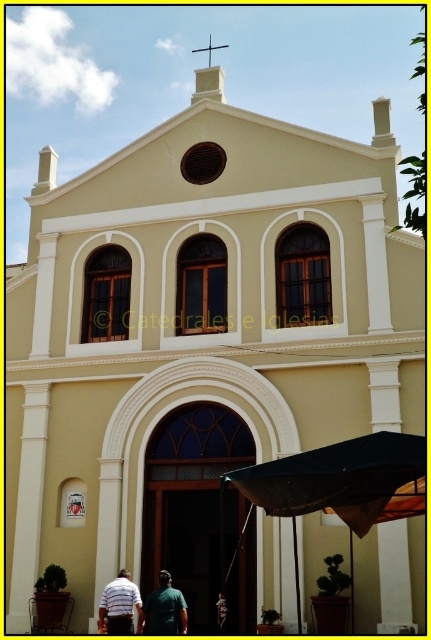
The image size is (431, 640). What do you see at coordinates (340, 483) in the screenshot?
I see `dark fabric umbrella at lower center` at bounding box center [340, 483].

Is dark fabric umbrella at lower center below green matte shirt at lower center?

Actually, dark fabric umbrella at lower center is above green matte shirt at lower center.

In order to click on dark fabric umbrella at lower center in this screenshot , I will do `click(340, 483)`.

You are a GUI agent. You are given a task and a screenshot of the screen. Output one action in this format:
    pyautogui.click(x=<x>, y=<y>)
    Task: Click on the dark fabric umbrella at lower center
    
    Given the screenshot: What is the action you would take?
    pyautogui.click(x=340, y=483)

Is dark fabric umbrella at lower center to the right of striped shirt at lower center from the viewer's perspective?

Yes, dark fabric umbrella at lower center is to the right of striped shirt at lower center.

Does dark fabric umbrella at lower center have a lesser height compared to striped shirt at lower center?

No, dark fabric umbrella at lower center is not shorter than striped shirt at lower center.

I want to click on dark fabric umbrella at lower center, so click(340, 483).

Does striped shirt at lower center have a greater height compared to green matte shirt at lower center?

Correct, striped shirt at lower center is much taller as green matte shirt at lower center.

Which is in front, point (119, 625) or point (174, 620)?

Point (174, 620)

What do you see at coordinates (118, 605) in the screenshot?
I see `striped shirt at lower center` at bounding box center [118, 605].

This screenshot has height=640, width=431. In order to click on striped shirt at lower center in this screenshot , I will do `click(118, 605)`.